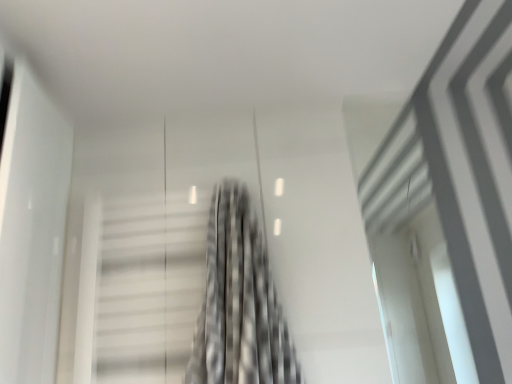
Question: Choose the correct answer: Is black textured curtain at center inside metallic staircase at center or outside it?

Choices:
 (A) outside
 (B) inside

Answer: (A)

Question: Considering the relative positions of black textured curtain at center and metallic staircase at center in the image provided, is black textured curtain at center to the left or to the right of metallic staircase at center?

Choices:
 (A) right
 (B) left

Answer: (A)

Question: From the image's perspective, relative to metallic staircase at center, is black textured curtain at center above or below?

Choices:
 (A) above
 (B) below

Answer: (A)

Question: In terms of width, does metallic staircase at center look wider or thinner when compared to black textured curtain at center?

Choices:
 (A) wide
 (B) thin

Answer: (B)

Question: Is metallic staircase at center in front of or behind black textured curtain at center in the image?

Choices:
 (A) behind
 (B) front

Answer: (A)

Question: Is metallic staircase at center bigger or smaller than black textured curtain at center?

Choices:
 (A) big
 (B) small

Answer: (B)

Question: Is metallic staircase at center inside the boundaries of black textured curtain at center, or outside?

Choices:
 (A) inside
 (B) outside

Answer: (B)